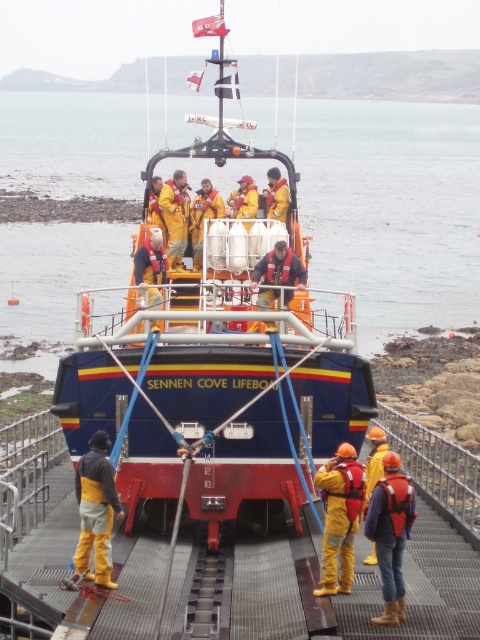
Question: Is blue glossy water at center closer to camera compared to yellow fabric helmet at center?

Choices:
 (A) no
 (B) yes

Answer: (A)

Question: Does blue painted fiberglass sennen cove lifeboat at center have a smaller size compared to yellow hard hat at center?

Choices:
 (A) yes
 (B) no

Answer: (B)

Question: Which of the following is the farthest from the observer?

Choices:
 (A) (420, 276)
 (B) (103, 577)
 (C) (400, 618)

Answer: (A)

Question: Can you confirm if blue painted fiberglass sennen cove lifeboat at center is bigger than yellow matte life jacket at center?

Choices:
 (A) no
 (B) yes

Answer: (B)

Question: Among these points, which one is farthest from the camera?

Choices:
 (A) (217, 192)
 (B) (97, 472)
 (C) (377, 465)

Answer: (A)

Question: Which object appears farthest from the camera in this image?

Choices:
 (A) yellow hard hat at center
 (B) yellow matte life jacket at center
 (C) blue painted fiberglass sennen cove lifeboat at center
 (D) blue glossy water at center

Answer: (D)